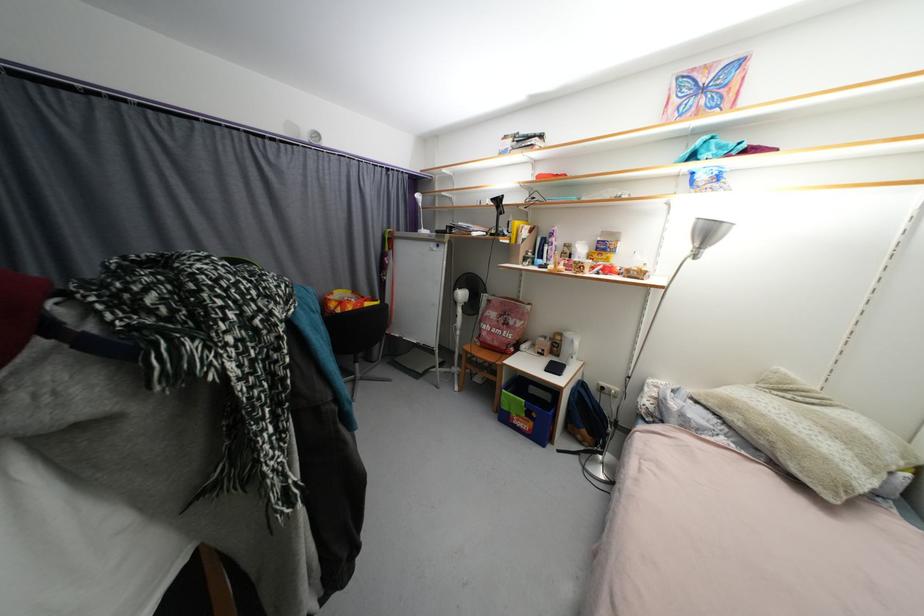
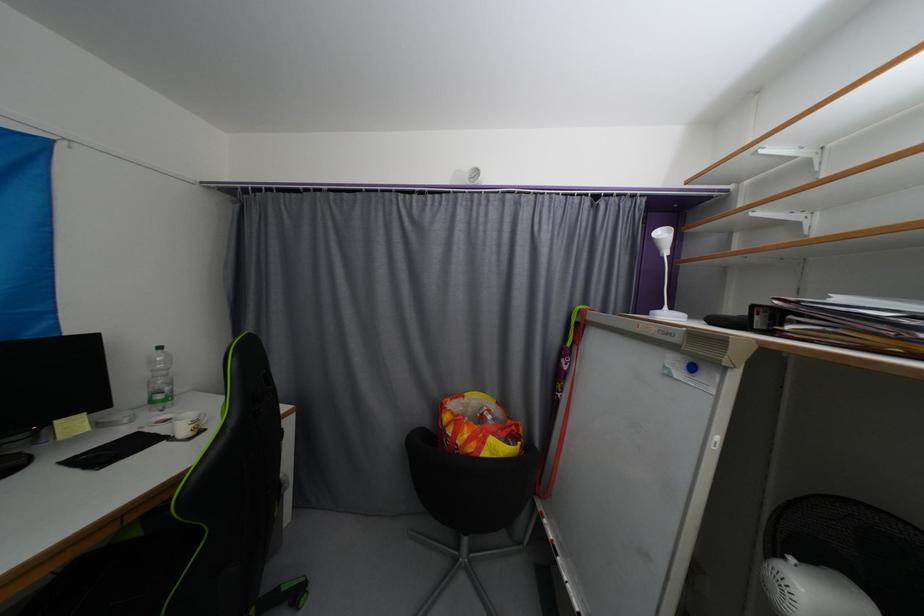
Find the pixel in the second image that matches pixel 430 233 in the first image.

(672, 317)